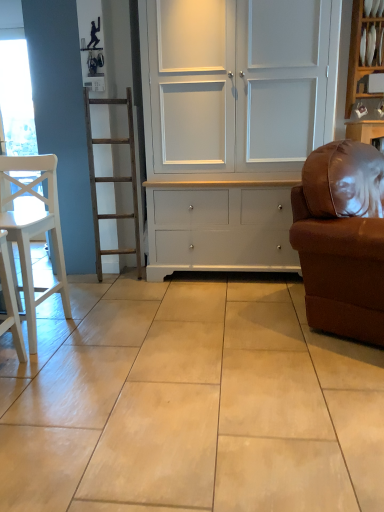
Question: Is white matte chair at left wider than white glossy shelf at upper right?

Choices:
 (A) no
 (B) yes

Answer: (B)

Question: Is white glossy shelf at upper right inside white matte chair at left?

Choices:
 (A) no
 (B) yes

Answer: (A)

Question: Considering the relative positions of white matte chair at left and white glossy shelf at upper right in the image provided, is white matte chair at left behind white glossy shelf at upper right?

Choices:
 (A) yes
 (B) no

Answer: (B)

Question: Is white matte chair at left to the right of white glossy shelf at upper right from the viewer's perspective?

Choices:
 (A) yes
 (B) no

Answer: (B)

Question: Is white matte chair at left positioned before white glossy shelf at upper right?

Choices:
 (A) yes
 (B) no

Answer: (A)

Question: From the image's perspective, would you say white matte chair at left is positioned over white glossy shelf at upper right?

Choices:
 (A) yes
 (B) no

Answer: (B)

Question: Is brown leather couch at right not within white matte chair at left?

Choices:
 (A) yes
 (B) no

Answer: (A)

Question: Is brown leather couch at right in contact with white matte chair at left?

Choices:
 (A) no
 (B) yes

Answer: (A)

Question: Is the position of brown leather couch at right less distant than that of white matte chair at left?

Choices:
 (A) no
 (B) yes

Answer: (B)

Question: Is brown leather couch at right wider than white matte chair at left?

Choices:
 (A) no
 (B) yes

Answer: (B)

Question: Is brown leather couch at right surrounding white matte chair at left?

Choices:
 (A) no
 (B) yes

Answer: (A)

Question: Does brown leather couch at right have a greater height compared to white matte chair at left?

Choices:
 (A) yes
 (B) no

Answer: (A)

Question: Are white matte chair at left and white painted wood cupboard at center beside each other?

Choices:
 (A) no
 (B) yes

Answer: (A)